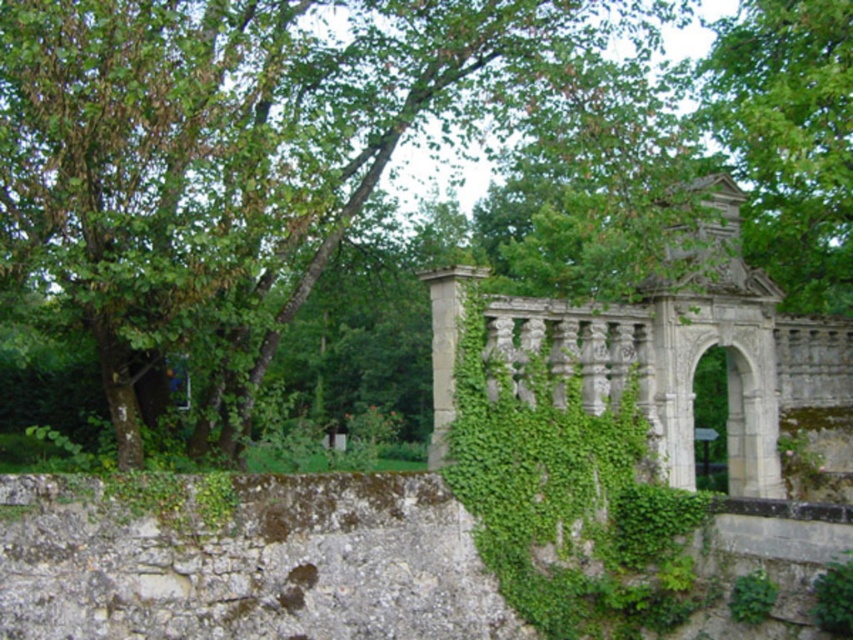
Question: Can you confirm if green leafy tree at upper left is bigger than green leafy tree at upper center?

Choices:
 (A) yes
 (B) no

Answer: (A)

Question: Can you confirm if green leafy tree at upper left is thinner than green leafy tree at upper center?

Choices:
 (A) no
 (B) yes

Answer: (A)

Question: Among these objects, which one is nearest to the camera?

Choices:
 (A) green leafy tree at upper center
 (B) green leafy tree at upper left

Answer: (B)

Question: Among these objects, which one is nearest to the camera?

Choices:
 (A) green leafy tree at upper left
 (B) green leafy tree at upper center

Answer: (A)

Question: Which object appears closest to the camera in this image?

Choices:
 (A) green leafy tree at upper left
 (B) green leafy tree at upper center

Answer: (A)

Question: Is green leafy tree at upper left smaller than green leafy tree at upper center?

Choices:
 (A) no
 (B) yes

Answer: (A)